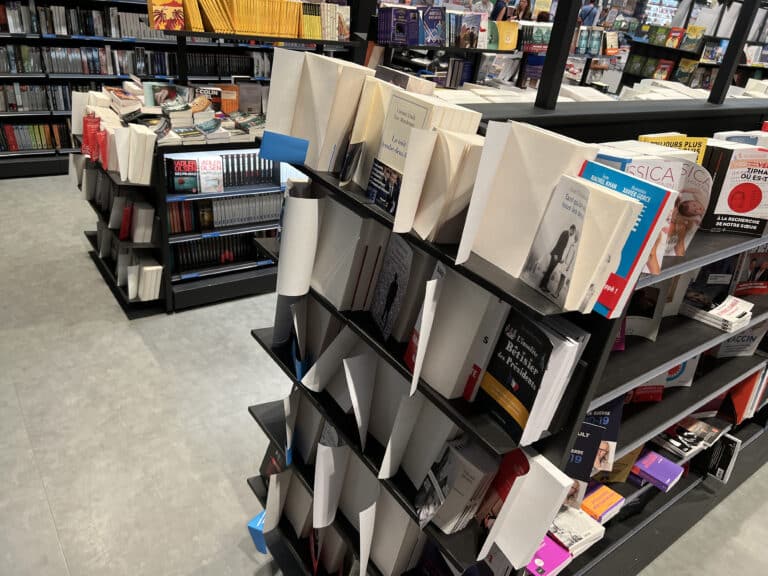
Image resolution: width=768 pixels, height=576 pixels. I want to click on white counter top[, so click(495, 92).